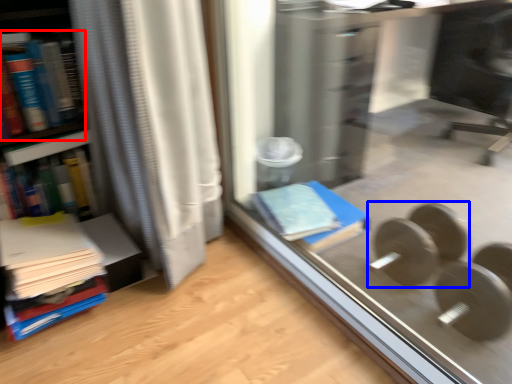
Question: Which point is further to the camera, book (highlighted by a red box) or dumbbell (highlighted by a blue box)?

Choices:
 (A) book
 (B) dumbbell

Answer: (B)